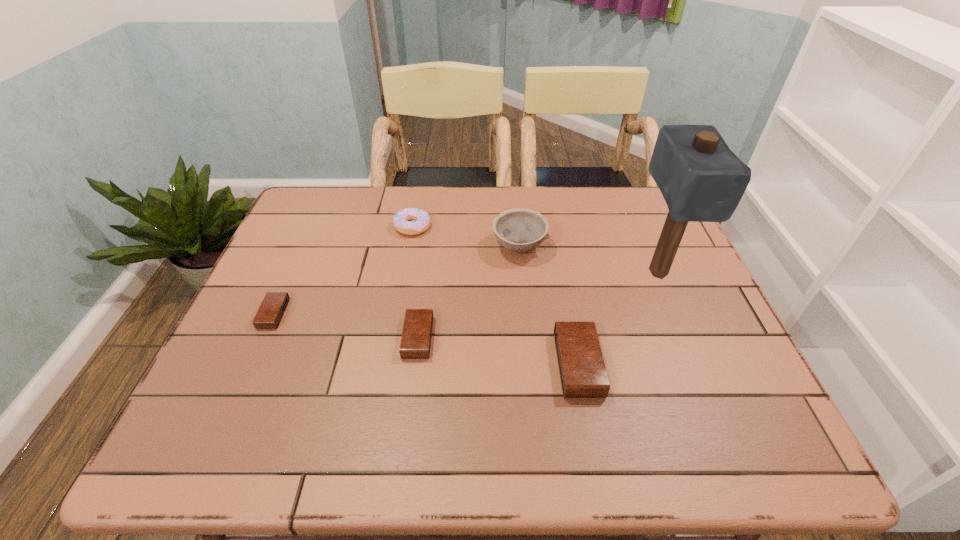
The width and height of the screenshot is (960, 540). Identify the location of free spot located 0.400m on the front face of the second shortest alarm clock. (605, 338).

This screenshot has height=540, width=960. In order to click on free space located 0.060m on the front face of the rightmost alarm clock in this screenshot , I will do `click(626, 364)`.

At what (x,y) coordinates should I click in order to perform the action: click on vacant space located on the left of the bowl. Please return your answer as a coordinate pair (x, y). Image resolution: width=960 pixels, height=540 pixels. Looking at the image, I should click on (361, 246).

Where is `vacant region located on the left of the doughnut`? vacant region located on the left of the doughnut is located at coordinates 350,227.

I want to click on free space located on the front of the rightmost object, so click(x=712, y=402).

Find the location of a particular element. bowl located at the far edge is located at coordinates (520, 230).

What are the coordinates of `doughnut situated at the far edge` in the screenshot? It's located at (402, 220).

This screenshot has height=540, width=960. Find the location of `object present at the near edge`. object present at the near edge is located at coordinates (583, 374).

This screenshot has height=540, width=960. In order to click on object situated at the left edge in this screenshot , I will do `click(272, 308)`.

Locate an element on the screen. Image resolution: width=960 pixels, height=540 pixels. object present at the right edge is located at coordinates (701, 179).